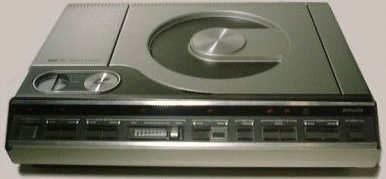
This screenshot has height=179, width=386. Identify the location of up and down switch. (244, 134).